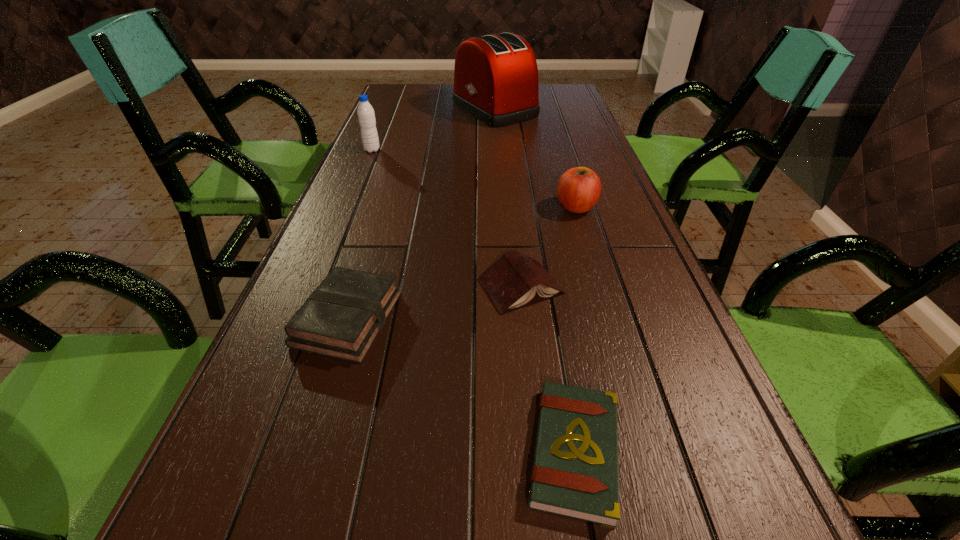
Where is `free space located on the back of the fifth nearest object`? free space located on the back of the fifth nearest object is located at coordinates (387, 114).

The width and height of the screenshot is (960, 540). Identify the location of vacant space located on the left of the third tallest object. (433, 207).

Find the location of a particular element. free location located 0.340m on the back of the leftmost book is located at coordinates (386, 197).

Where is `vacant space located on the back of the nearest book`? vacant space located on the back of the nearest book is located at coordinates tap(541, 256).

Where is `object present at the far edge`? The height and width of the screenshot is (540, 960). object present at the far edge is located at coordinates (496, 76).

Locate an element on the screen. This screenshot has height=540, width=960. water bottle that is at the left edge is located at coordinates (366, 116).

At what (x,y) coordinates should I click in order to perform the action: click on book present at the left edge. Please return your answer as a coordinate pair (x, y). Image resolution: width=960 pixels, height=540 pixels. Looking at the image, I should click on (341, 319).

At what (x,y) coordinates should I click in order to perform the action: click on object that is positioned at the right edge. Please return your answer as a coordinate pair (x, y). Image resolution: width=960 pixels, height=540 pixels. Looking at the image, I should click on (578, 190).

Where is `free space at the left edge`? The width and height of the screenshot is (960, 540). free space at the left edge is located at coordinates (246, 383).

In the image, there is a desktop. Where is `vacant area at the right edge`? vacant area at the right edge is located at coordinates (607, 167).